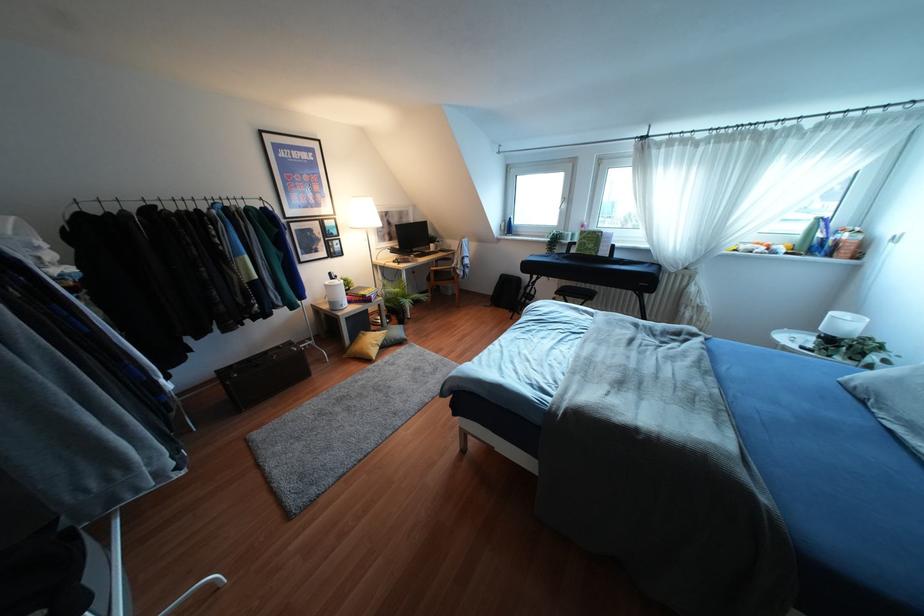
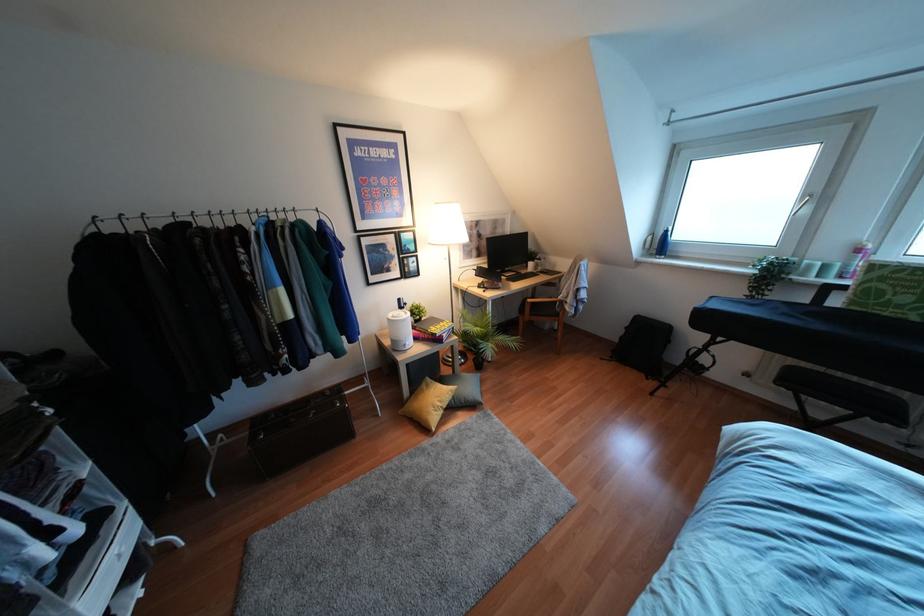
Locate, in the second image, the point that corresponds to (x=566, y=233) in the first image.

(809, 265)